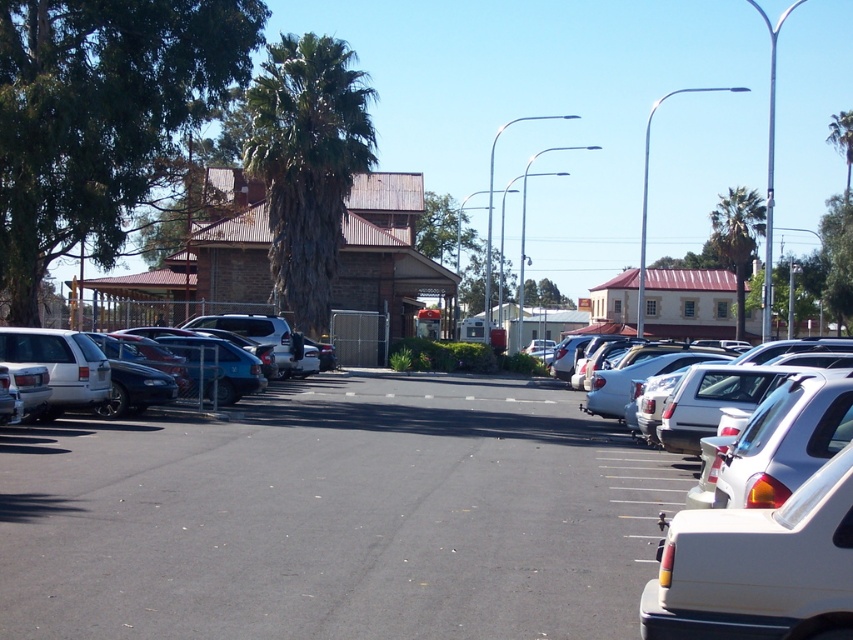
Question: Does matte black sedan at left have a greater width compared to white matte car at right?

Choices:
 (A) yes
 (B) no

Answer: (B)

Question: Estimate the real-world distances between objects in this image. Which object is farther from the white matte car at right?

Choices:
 (A) green leafy palm tree at upper center
 (B) white matte car at center

Answer: (A)

Question: Which of the following is the closest to the observer?

Choices:
 (A) matte black sedan at left
 (B) green leafy palm tree at upper center
 (C) white matte car at center

Answer: (C)

Question: Can you confirm if white matte car at center is positioned to the left of green leafy palm tree at upper center?

Choices:
 (A) no
 (B) yes

Answer: (B)

Question: Which of the following is the closest to the observer?

Choices:
 (A) (273, 152)
 (B) (61, 365)
 (C) (439, 568)
 (D) (682, 490)

Answer: (C)

Question: Considering the relative positions of green leafy palm tree at center and matte black sedan at left in the image provided, where is green leafy palm tree at center located with respect to matte black sedan at left?

Choices:
 (A) above
 (B) below

Answer: (A)